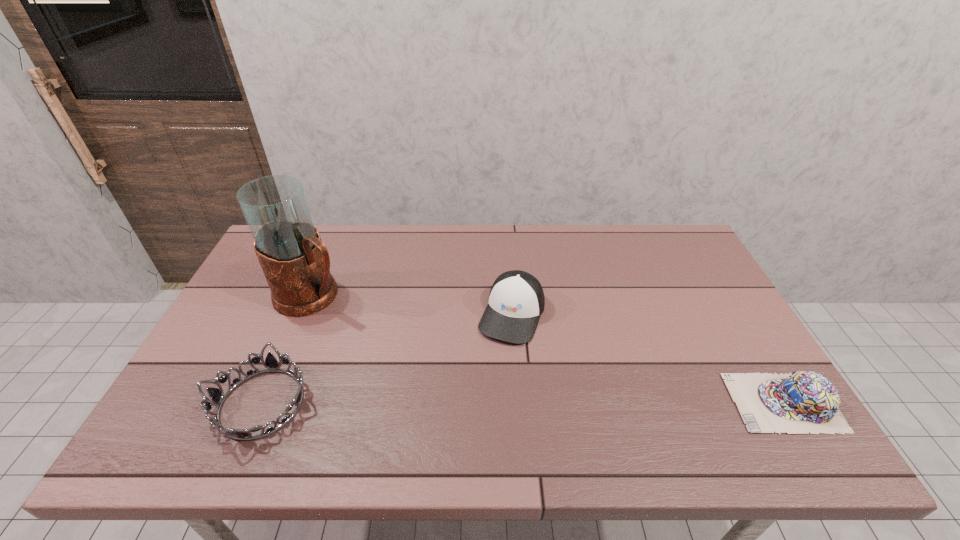
What are the coordinates of `tiara` in the screenshot? It's located at (217, 396).

Identify the location of the right cap. (800, 402).

Where is `the nearer cap`? Image resolution: width=960 pixels, height=540 pixels. the nearer cap is located at coordinates (800, 402).

The width and height of the screenshot is (960, 540). I want to click on the second object from right to left, so click(x=516, y=300).

Identify the location of the second tallest object. (516, 300).

Where is `pitcher`? pitcher is located at coordinates coord(296,264).

Find the location of a particular element. The image size is (960, 540). free location located on the front, side, and top of the right cap is located at coordinates (587, 402).

The image size is (960, 540). I want to click on vacant space located on the front, side, and top of the right cap, so click(x=640, y=402).

Locate an element on the screen. This screenshot has width=960, height=540. free spot located on the front, side, and top of the right cap is located at coordinates (565, 402).

Find the location of a particular element. free space located 0.220m on the front panel of the third object from left to right is located at coordinates (474, 413).